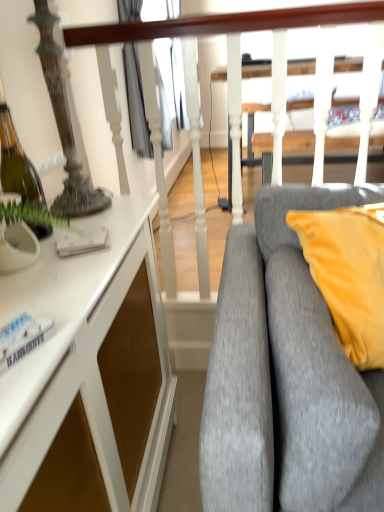
Question: Is gray fabric couch at right wider or thinner than white textured rail at upper center?

Choices:
 (A) wide
 (B) thin

Answer: (A)

Question: In the image, is gray fabric couch at right on the left side or the right side of white textured rail at upper center?

Choices:
 (A) left
 (B) right

Answer: (B)

Question: Considering the real-world distances, which object is farthest from the white glossy cabinet at left?

Choices:
 (A) white textured rail at upper center
 (B) gray fabric couch at right

Answer: (A)

Question: Estimate the real-world distances between objects in this image. Which object is farther from the white glossy cabinet at left?

Choices:
 (A) gray fabric couch at right
 (B) white textured rail at upper center

Answer: (B)